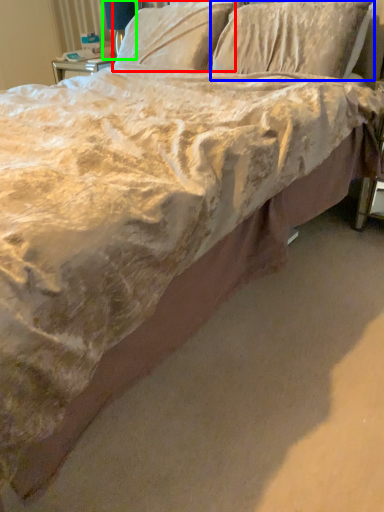
Question: Estimate the real-world distances between objects in this image. Which object is closer to pillow (highlighted by a red box), pillow (highlighted by a blue box) or table lamp (highlighted by a green box)?

Choices:
 (A) pillow
 (B) table lamp

Answer: (A)